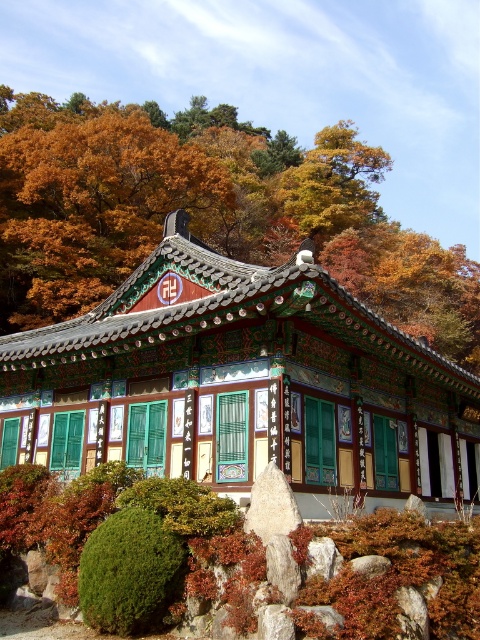
Question: Is polished wood gazebo at center positioned behind green fuzzy bush at lower left?

Choices:
 (A) no
 (B) yes

Answer: (B)

Question: Is autumn leaves at center wider than autumn leaves at upper center?

Choices:
 (A) no
 (B) yes

Answer: (B)

Question: Which object appears closest to the camera in this image?

Choices:
 (A) polished wood gazebo at center
 (B) green fuzzy bush at lower left

Answer: (B)

Question: Considering the real-world distances, which object is farthest from the autumn leaves at upper center?

Choices:
 (A) polished wood gazebo at center
 (B) autumn leaves at center

Answer: (A)

Question: Does autumn leaves at upper center lie in front of green fuzzy bush at lower left?

Choices:
 (A) yes
 (B) no

Answer: (B)

Question: Which object is the closest to the polished wood gazebo at center?

Choices:
 (A) autumn leaves at upper center
 (B) green fuzzy bush at lower left
 (C) autumn leaves at center

Answer: (B)